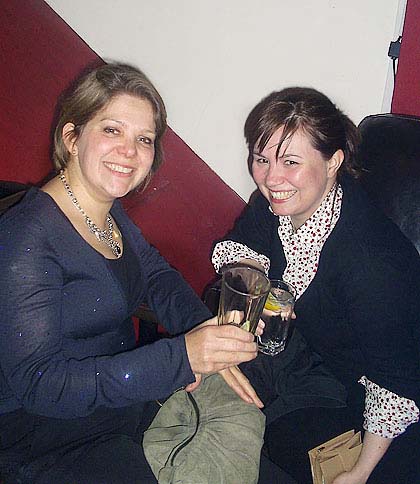
Where is `glass`? glass is located at coordinates (241, 309), (270, 308).